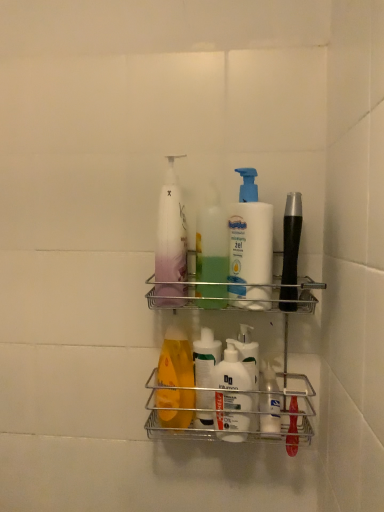
Question: Can you confirm if translucent plastic pump bottle at center, which is the third cleaning product from right to left, is positioned to the left of white matte lotion at center, the 1th cleaning product in the right-to-left sequence?

Choices:
 (A) yes
 (B) no

Answer: (A)

Question: Does translucent plastic pump bottle at center, which is the first cleaning product in left-to-right order, touch white matte lotion at center, which is the 3th cleaning product in left-to-right order?

Choices:
 (A) yes
 (B) no

Answer: (B)

Question: Does translucent plastic pump bottle at center, which is the first cleaning product in left-to-right order, turn towards white matte lotion at center, the 1th cleaning product in the right-to-left sequence?

Choices:
 (A) no
 (B) yes

Answer: (A)

Question: Can you confirm if translucent plastic pump bottle at center, which is the third cleaning product from right to left, is shorter than white matte lotion at center, which is the 3th cleaning product in left-to-right order?

Choices:
 (A) no
 (B) yes

Answer: (A)

Question: From the image's perspective, is translucent plastic pump bottle at center, which is the third cleaning product from right to left, above white matte lotion at center, the 1th cleaning product in the right-to-left sequence?

Choices:
 (A) yes
 (B) no

Answer: (A)

Question: Is metallic silver shelf at center bigger or smaller than translucent plastic pump bottle at center, which is the first cleaning product in left-to-right order?

Choices:
 (A) small
 (B) big

Answer: (B)

Question: Is point (192, 364) closer or farther from the camera than point (182, 244)?

Choices:
 (A) farther
 (B) closer

Answer: (A)

Question: Is metallic silver shelf at center to the left or to the right of translucent plastic pump bottle at center, which is the first cleaning product in left-to-right order, in the image?

Choices:
 (A) left
 (B) right

Answer: (B)

Question: Is metallic silver shelf at center in front of or behind translucent plastic pump bottle at center, which is the first cleaning product in left-to-right order, in the image?

Choices:
 (A) behind
 (B) front

Answer: (B)

Question: From a real-world perspective, is metallic silver shelf at center positioned above or below white matte lotion at center, which is the 3th cleaning product in left-to-right order?

Choices:
 (A) above
 (B) below

Answer: (B)

Question: Considering their positions, is metallic silver shelf at center located in front of or behind white matte lotion at center, the 1th cleaning product in the right-to-left sequence?

Choices:
 (A) behind
 (B) front

Answer: (B)

Question: In the image, is metallic silver shelf at center on the left side or the right side of white matte lotion at center, the 1th cleaning product in the right-to-left sequence?

Choices:
 (A) left
 (B) right

Answer: (A)

Question: Is metallic silver shelf at center taller or shorter than white matte lotion at center, which is the 3th cleaning product in left-to-right order?

Choices:
 (A) tall
 (B) short

Answer: (A)

Question: From a real-world perspective, is white matte lotion at center, the 1th cleaning product in the right-to-left sequence, positioned above or below translucent plastic bottle at center, positioned as the second cleaning product in right-to-left order?

Choices:
 (A) above
 (B) below

Answer: (B)

Question: Is point (x=256, y=269) positioned closer to the camera than point (x=211, y=204)?

Choices:
 (A) farther
 (B) closer

Answer: (B)